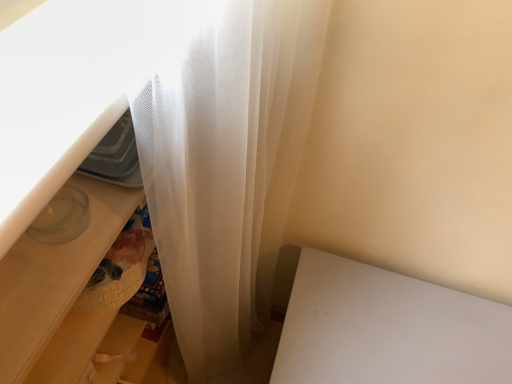
Locate an element on the screen. free spot above white matte table at lower right (from a real-world perspective) is located at coordinates (403, 327).